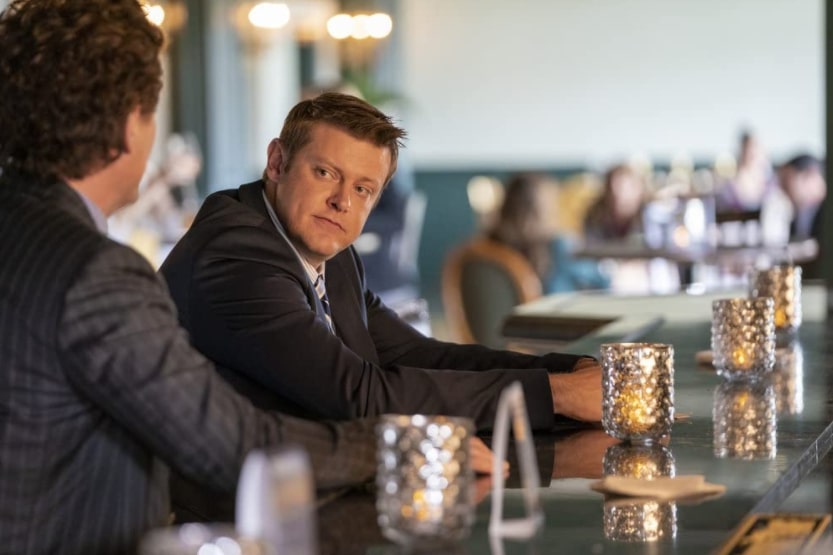
At what (x,y) coordinates should I click in order to perform the action: click on lights. Please return your answer as a coordinate pair (x, y). This screenshot has width=833, height=555. Looking at the image, I should click on (343, 30), (271, 20), (148, 13).